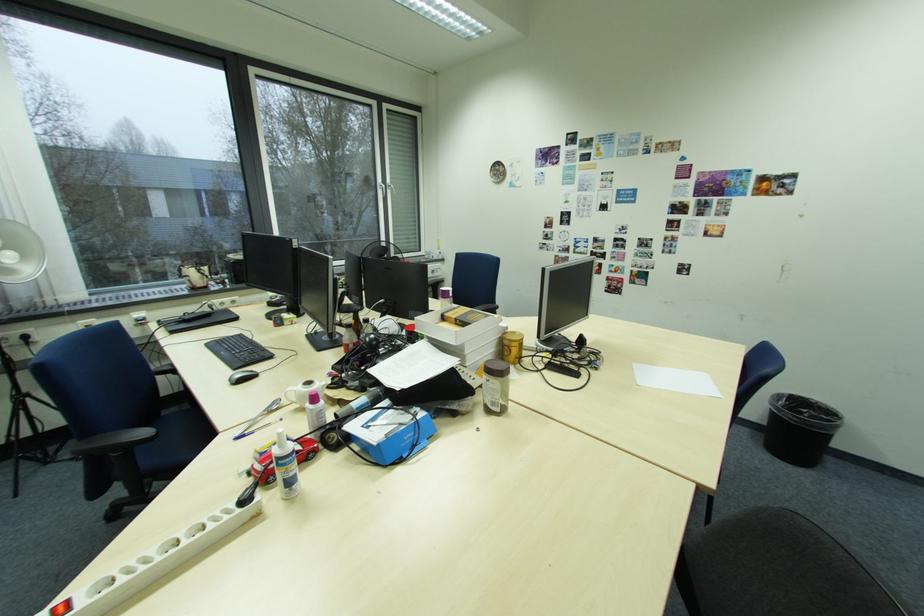
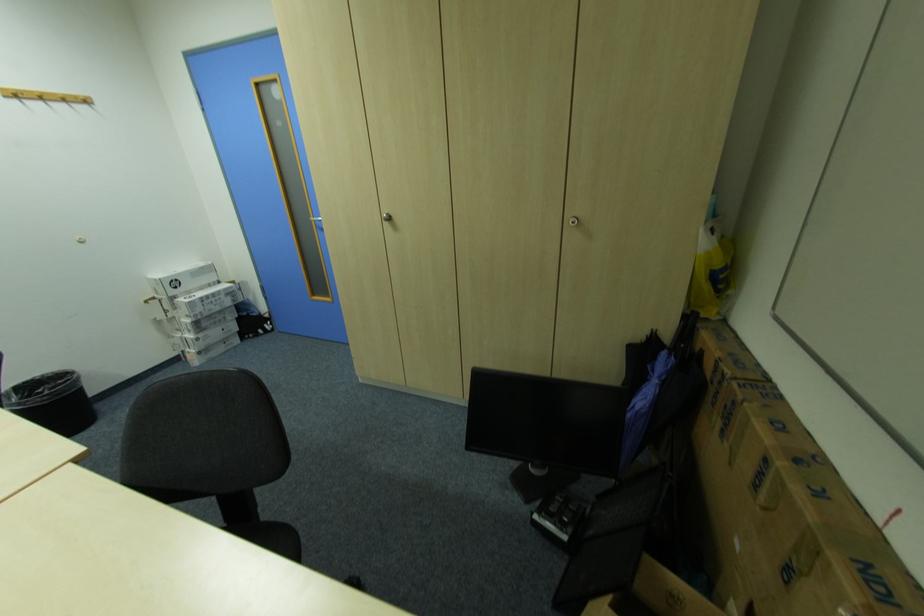
In the second image, find the point that corresponds to the point at 811,411 in the first image.

(49, 391)